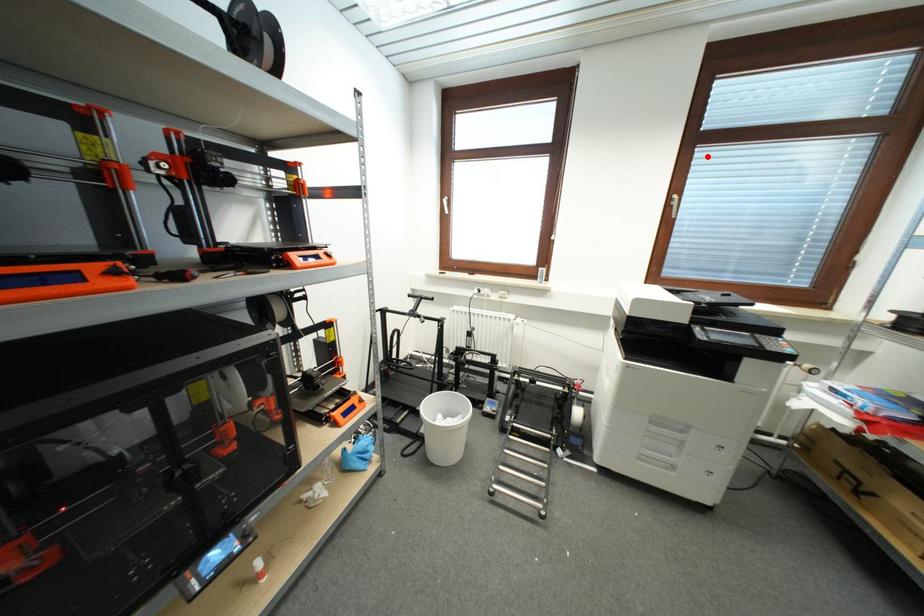
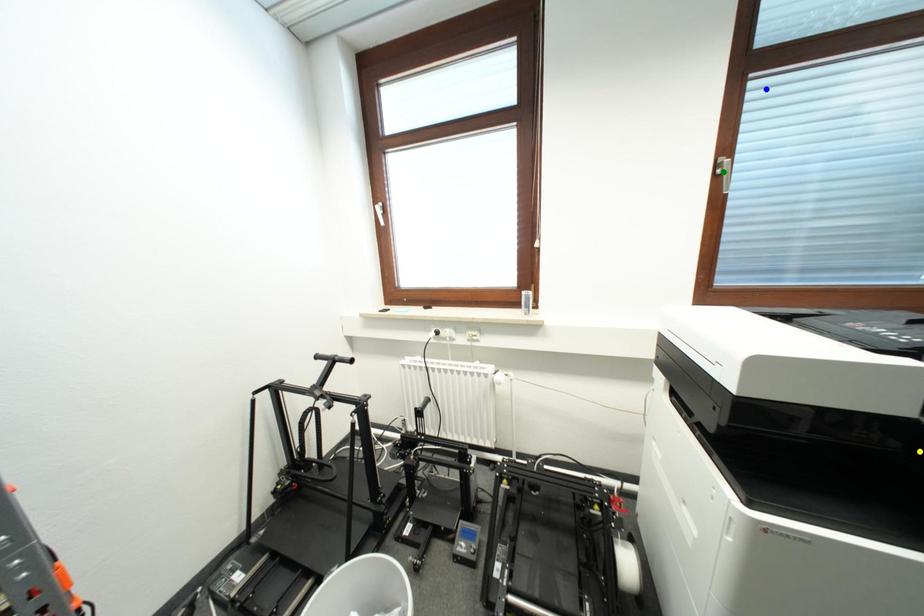
Question: I am providing you with two images of the same scene from different viewpoints. A red point is marked on the first image. You are given multiple points on the second image. Can you choose the point in image 2 that corresponds to the point in image 1?

Choices:
 (A) green point
 (B) yellow point
 (C) blue point

Answer: (C)